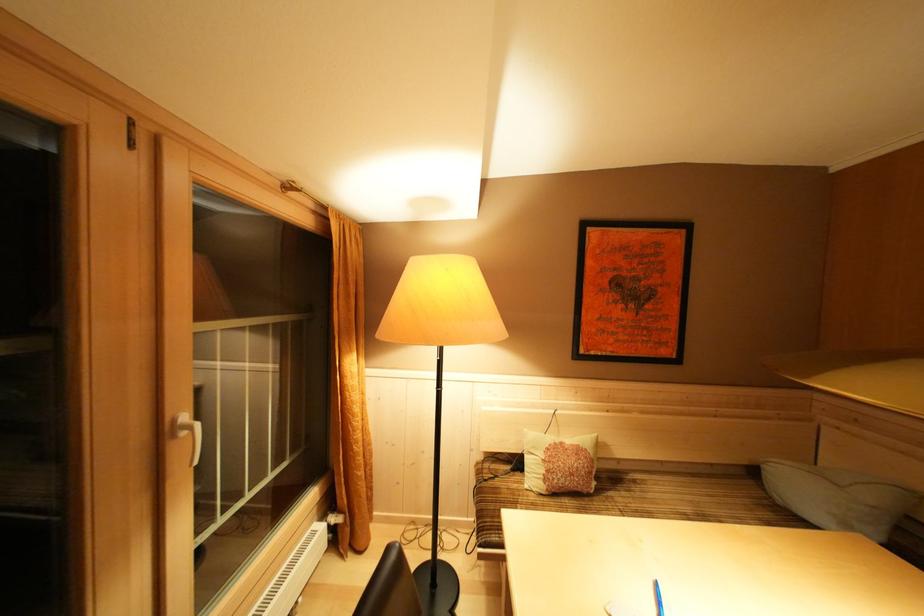
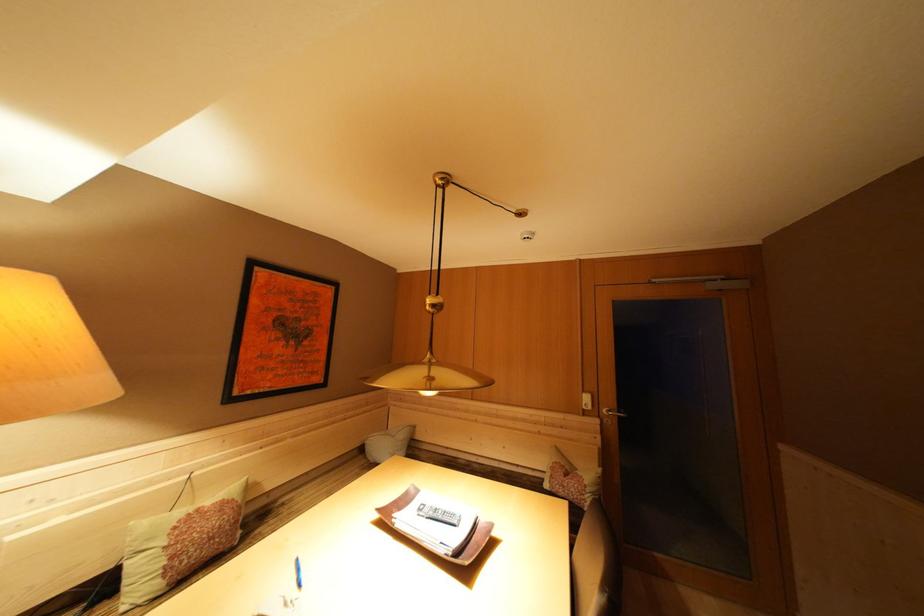
The point at (568,448) is marked in the first image. Where is the corresponding point in the second image?

(204, 515)